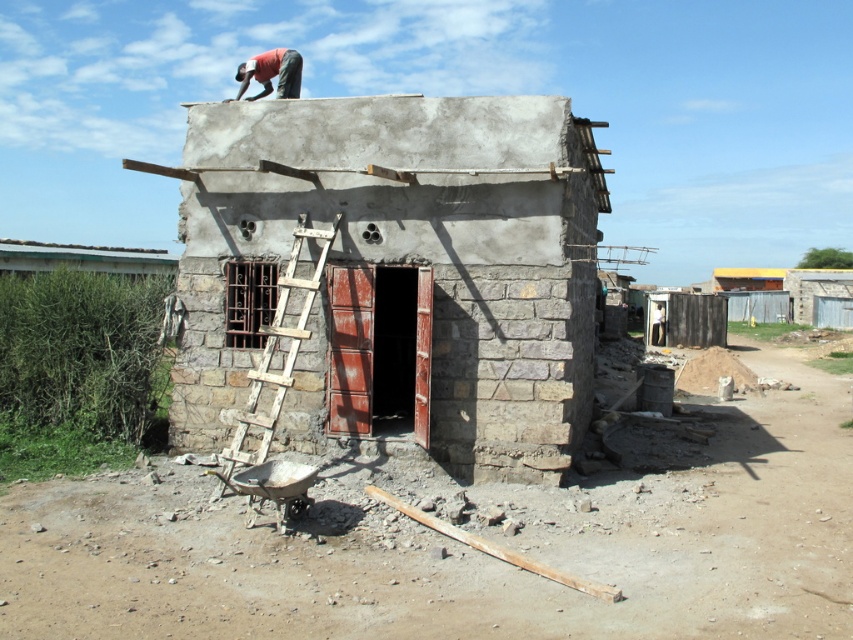
Question: Is smooth concrete hut at center to the right of matte red shirt at upper center from the viewer's perspective?

Choices:
 (A) no
 (B) yes

Answer: (B)

Question: Estimate the real-world distances between objects in this image. Which object is farther from the weathered wood ladder at center?

Choices:
 (A) smooth concrete hut at center
 (B) matte red shirt at upper center

Answer: (B)

Question: Does smooth concrete hut at center have a larger size compared to weathered wood ladder at center?

Choices:
 (A) no
 (B) yes

Answer: (A)

Question: Is smooth concrete hut at center positioned before weathered wood ladder at center?

Choices:
 (A) yes
 (B) no

Answer: (B)

Question: Which object is farther from the camera taking this photo?

Choices:
 (A) weathered wood ladder at center
 (B) smooth concrete hut at center

Answer: (B)

Question: Which point is farther from the camera taking this photo?

Choices:
 (A) (270, 88)
 (B) (263, 349)
 (C) (305, 384)

Answer: (A)